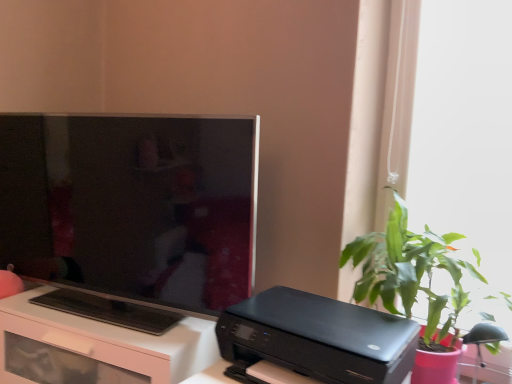
Question: Is green leafy plant at right directly adjacent to black glossy printer at lower center?

Choices:
 (A) yes
 (B) no

Answer: (B)

Question: From the image's perspective, is green leafy plant at right on top of black glossy printer at lower center?

Choices:
 (A) yes
 (B) no

Answer: (A)

Question: Would you consider green leafy plant at right to be distant from black glossy printer at lower center?

Choices:
 (A) yes
 (B) no

Answer: (B)

Question: Can you confirm if green leafy plant at right is positioned to the right of black glossy printer at lower center?

Choices:
 (A) no
 (B) yes

Answer: (B)

Question: Is green leafy plant at right outside of black glossy printer at lower center?

Choices:
 (A) yes
 (B) no

Answer: (A)

Question: Considering the relative sizes of green leafy plant at right and black glossy printer at lower center in the image provided, is green leafy plant at right smaller than black glossy printer at lower center?

Choices:
 (A) yes
 (B) no

Answer: (B)

Question: Considering the relative sizes of black glossy printer at lower center and matte black tv at left in the image provided, is black glossy printer at lower center bigger than matte black tv at left?

Choices:
 (A) yes
 (B) no

Answer: (B)

Question: Does black glossy printer at lower center come behind matte black tv at left?

Choices:
 (A) yes
 (B) no

Answer: (B)

Question: Can you confirm if black glossy printer at lower center is positioned to the right of matte black tv at left?

Choices:
 (A) no
 (B) yes

Answer: (B)

Question: Is black glossy printer at lower center to the left of matte black tv at left from the viewer's perspective?

Choices:
 (A) no
 (B) yes

Answer: (A)

Question: Considering the relative sizes of black glossy printer at lower center and matte black tv at left in the image provided, is black glossy printer at lower center smaller than matte black tv at left?

Choices:
 (A) yes
 (B) no

Answer: (A)

Question: From a real-world perspective, is black glossy printer at lower center below matte black tv at left?

Choices:
 (A) no
 (B) yes

Answer: (B)

Question: Is matte black tv at left closer to camera compared to white glossy desk at lower left?

Choices:
 (A) yes
 (B) no

Answer: (A)